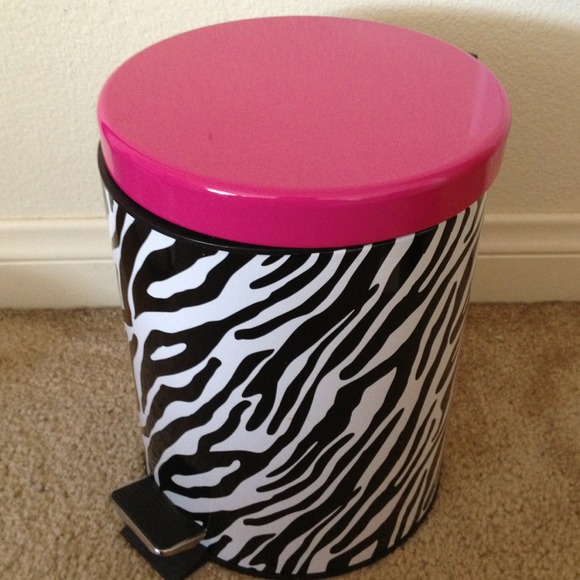
You are a GUI agent. You are given a task and a screenshot of the screen. Output one action in this format:
    pyautogui.click(x=<x>, y=<y>)
    Task: Click on the wall
    
    Given the screenshot: What is the action you would take?
    pyautogui.click(x=535, y=200)